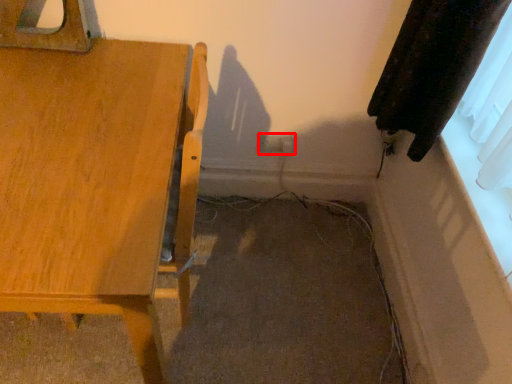
Question: From the image, what is the correct spatial relationship of electric outlet (annotated by the red box) in relation to furniture?

Choices:
 (A) right
 (B) left

Answer: (A)